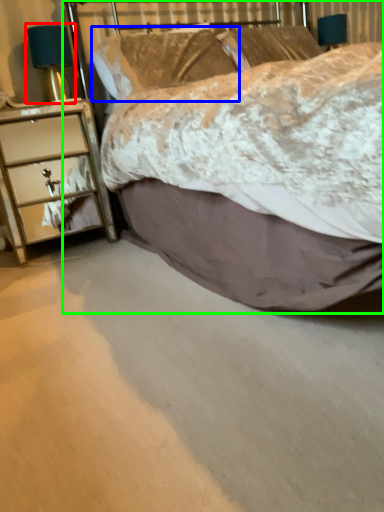
Question: Which is farther away from bedside lamp (highlighted by a red box)? pillow (highlighted by a blue box) or bed (highlighted by a green box)?

Choices:
 (A) pillow
 (B) bed

Answer: (B)